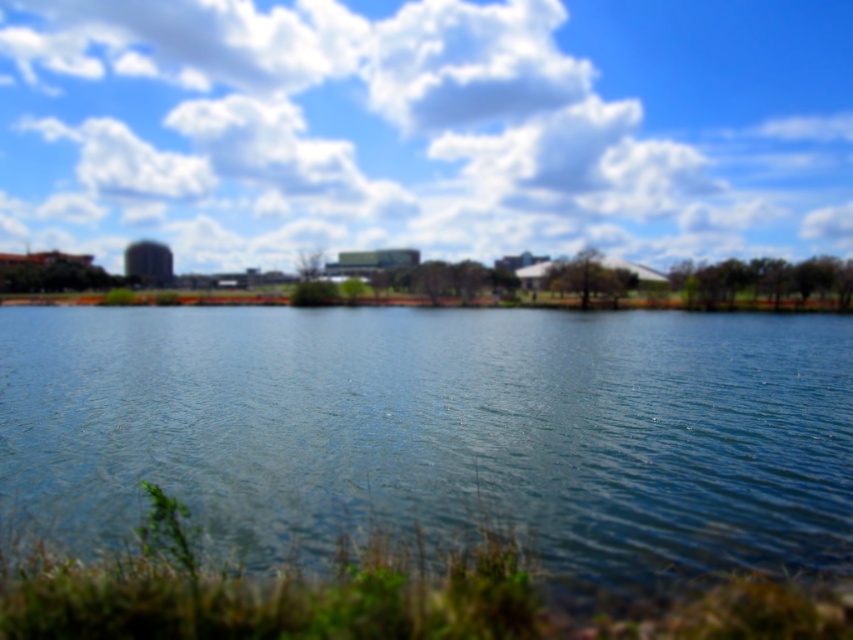
Who is positioned more to the left, white fluffy cloud at upper center or clear water at center?

white fluffy cloud at upper center

Measure the distance from white fluffy cloud at upper center to clear water at center.

The distance of white fluffy cloud at upper center from clear water at center is 179.80 meters.

Does point (509, 208) lie behind point (805, 547)?

Yes, it is behind point (805, 547).

This screenshot has width=853, height=640. I want to click on white fluffy cloud at upper center, so click(426, 128).